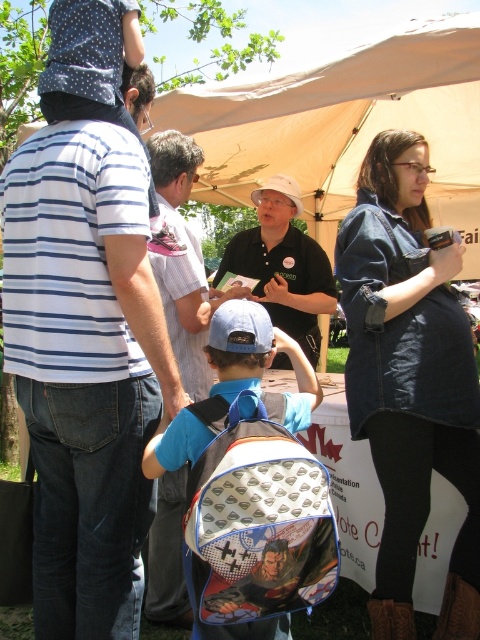
You are standing at the center of the image. Which object is located at the point with coordinates [409,380]?

The point at coordinates [409,380] marks the denim jacket at upper right.

You are organizing a photo shoot under the beige canopy tent and need to position two props, the denim jacket at upper right and the blue fabric backpack at center, exactly 36 inches apart. Based on their current positions, do you need to move them closer together or farther apart to meet the requirement?

The denim jacket at upper right and blue fabric backpack at center are currently 34.87 inches apart. Since 34.87 inches is less than the required 36 inches, you need to move them farther apart to meet the requirement.

You are standing under the beige canopy tent at the community event. You see a man in a blue striped shirt at center and a blue fabric backpack at center. Which object is closer to the ground?

The blue striped shirt at center is located below the blue fabric backpack at center, so the blue striped shirt at center is closer to the ground.